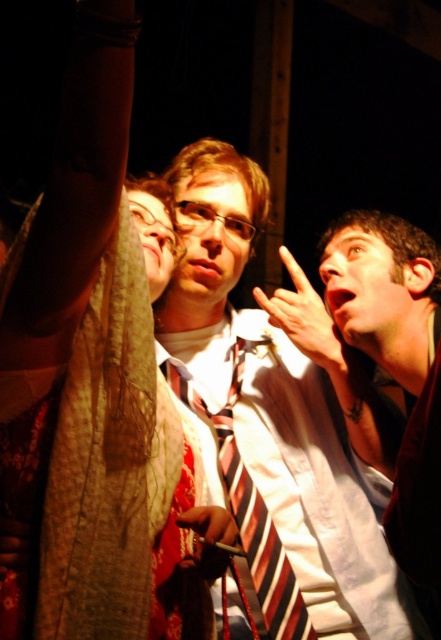
Question: Which point appears farthest from the camera in this image?

Choices:
 (A) (291, 604)
 (B) (328, 339)

Answer: (B)

Question: Does smooth skin hand at upper right appear on the right side of smooth leather handbag at center?

Choices:
 (A) no
 (B) yes

Answer: (B)

Question: Can you confirm if smooth skin hand at upper right is positioned to the right of smooth leather handbag at center?

Choices:
 (A) yes
 (B) no

Answer: (A)

Question: Which object is positioned closest to the striped fabric tie at center?

Choices:
 (A) striped tie at center
 (B) smooth leather handbag at center

Answer: (A)

Question: Among these objects, which one is farthest from the camera?

Choices:
 (A) striped tie at center
 (B) smooth skin hand at upper right
 (C) smooth leather handbag at center

Answer: (B)

Question: Is striped fabric tie at center bigger than smooth skin hand at upper right?

Choices:
 (A) yes
 (B) no

Answer: (A)